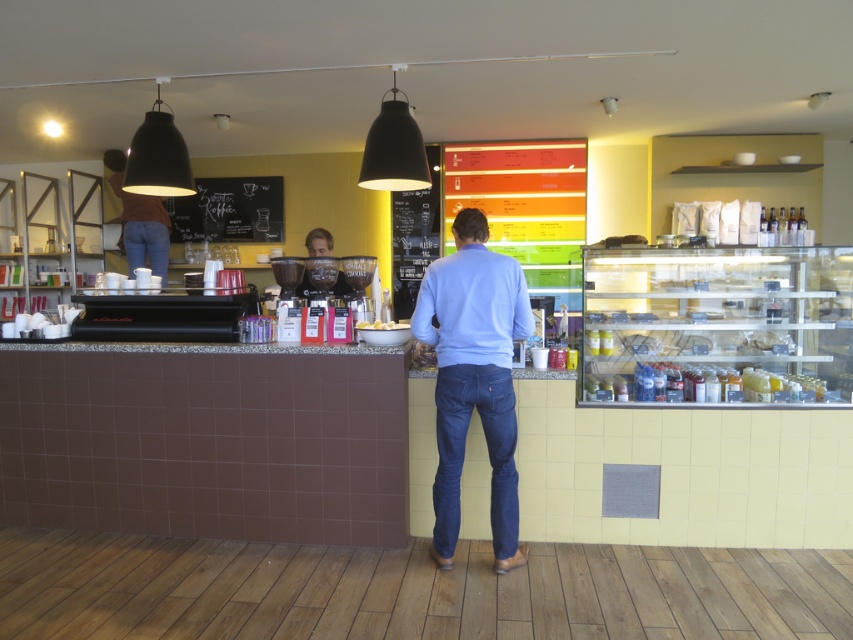
Is chalkboard at center bigger than denim at left?

Correct, chalkboard at center is larger in size than denim at left.

Which is in front, point (241, 195) or point (149, 230)?

Point (149, 230)

Is point (277, 196) more distant than point (164, 248)?

Yes, it is.

Where is `chalkboard at center`? This screenshot has width=853, height=640. chalkboard at center is located at coordinates (229, 211).

Can you confirm if blue denim jeans at center is smaller than dark blue denim jeans at center?

No.

In order to click on blue denim jeans at center in this screenshot , I will do `click(474, 378)`.

Which is behind, point (492, 388) or point (448, 445)?

Positioned behind is point (448, 445).

Image resolution: width=853 pixels, height=640 pixels. I want to click on blue denim jeans at center, so click(474, 378).

Is point (282, 234) in front of point (341, 273)?

No, (282, 234) is further to viewer.

Identify the location of chalkboard at center. (229, 211).